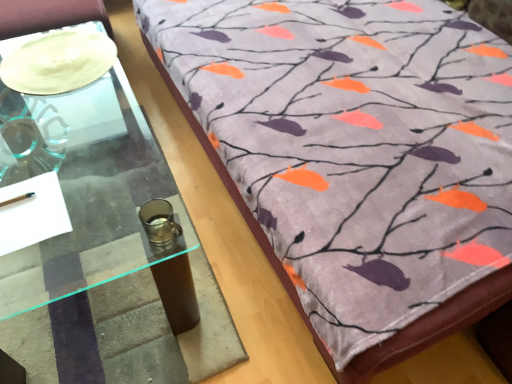
Question: Considering the positions of clear glass table at left and white matte plate at upper left in the image, is clear glass table at left wider or thinner than white matte plate at upper left?

Choices:
 (A) thin
 (B) wide

Answer: (B)

Question: In terms of height, does clear glass table at left look taller or shorter compared to white matte plate at upper left?

Choices:
 (A) short
 (B) tall

Answer: (B)

Question: Estimate the real-world distances between objects in this image. Which object is farther from the velvet fabric bedspread at upper right?

Choices:
 (A) white matte plate at upper left
 (B) clear glass table at left

Answer: (A)

Question: Estimate the real-world distances between objects in this image. Which object is closer to the white matte plate at upper left?

Choices:
 (A) clear glass table at left
 (B) velvet fabric bedspread at upper right

Answer: (A)